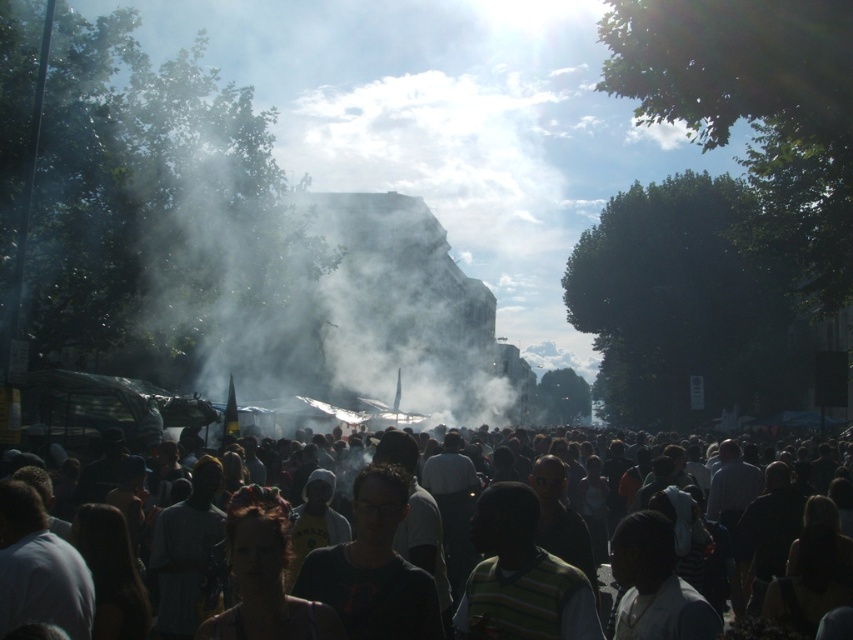
Question: Estimate the real-world distances between objects in this image. Which object is closer to the white vapor at center?

Choices:
 (A) striped cotton shirt at center
 (B) dark clothing crowd at center

Answer: (B)

Question: Can you confirm if dark clothing crowd at center is positioned below striped cotton shirt at center?

Choices:
 (A) no
 (B) yes

Answer: (A)

Question: Is white vapor at center behind dark clothing crowd at center?

Choices:
 (A) yes
 (B) no

Answer: (A)

Question: Is white vapor at center positioned at the back of dark clothing crowd at center?

Choices:
 (A) no
 (B) yes

Answer: (B)

Question: Which point appears farthest from the camera in this image?

Choices:
 (A) click(x=479, y=621)
 (B) click(x=763, y=500)

Answer: (B)

Question: Which point is closer to the camera?

Choices:
 (A) (694, 557)
 (B) (550, 628)
 (C) (328, 227)

Answer: (B)